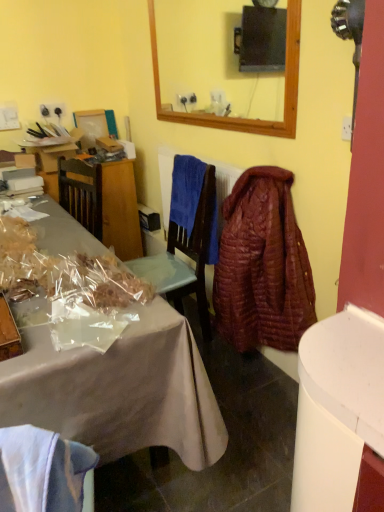
Question: Is blue soft towel at center situated inside metallic cardboard box at lower left or outside?

Choices:
 (A) inside
 (B) outside

Answer: (B)

Question: In the image, is blue soft towel at center positioned in front of or behind metallic cardboard box at lower left?

Choices:
 (A) front
 (B) behind

Answer: (B)

Question: Which object is the closest to the metallic cardboard box at lower left?

Choices:
 (A) quilted brown robe at center right
 (B) blue soft towel at center

Answer: (B)

Question: Estimate the real-world distances between objects in this image. Which object is farther from the quilted brown robe at center right?

Choices:
 (A) blue soft towel at center
 (B) metallic cardboard box at lower left

Answer: (B)